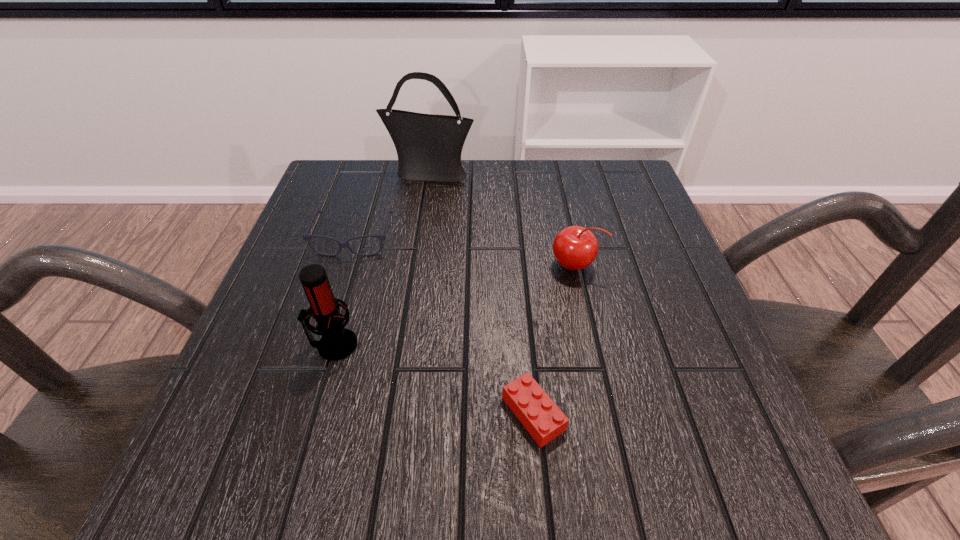
At what (x,y) coordinates should I click in order to perform the action: click on vacant area that lies between the rightmost object and the second object from right to left. Please return your answer as a coordinate pair (x, y). This screenshot has height=540, width=960. Looking at the image, I should click on (554, 340).

Locate an element on the screen. The image size is (960, 540). vacant area that lies between the second tallest object and the shoulder bag is located at coordinates (382, 259).

Where is `free space between the farthest object and the nearest object`? The width and height of the screenshot is (960, 540). free space between the farthest object and the nearest object is located at coordinates (481, 293).

In order to click on free point between the fourth tallest object and the farthest object in this screenshot , I will do `click(392, 206)`.

You are a GUI agent. You are given a task and a screenshot of the screen. Output one action in this format:
    pyautogui.click(x=<x>, y=<y>)
    Task: Click on the free space between the tallest object and the second shortest object
    
    Given the screenshot: What is the action you would take?
    pyautogui.click(x=392, y=206)

The width and height of the screenshot is (960, 540). I want to click on free point between the farthest object and the spectacles, so click(392, 206).

Where is `empty space between the microphone and the rightmost object`? The height and width of the screenshot is (540, 960). empty space between the microphone and the rightmost object is located at coordinates (454, 305).

Identify the location of free area in between the rightmost object and the tallest object. The height and width of the screenshot is (540, 960). (502, 219).

Locate an element on the screen. The image size is (960, 540). object identified as the fourth closest to the spectacles is located at coordinates (542, 418).

This screenshot has width=960, height=540. I want to click on the closest object relative to the fourth tallest object, so click(x=429, y=147).